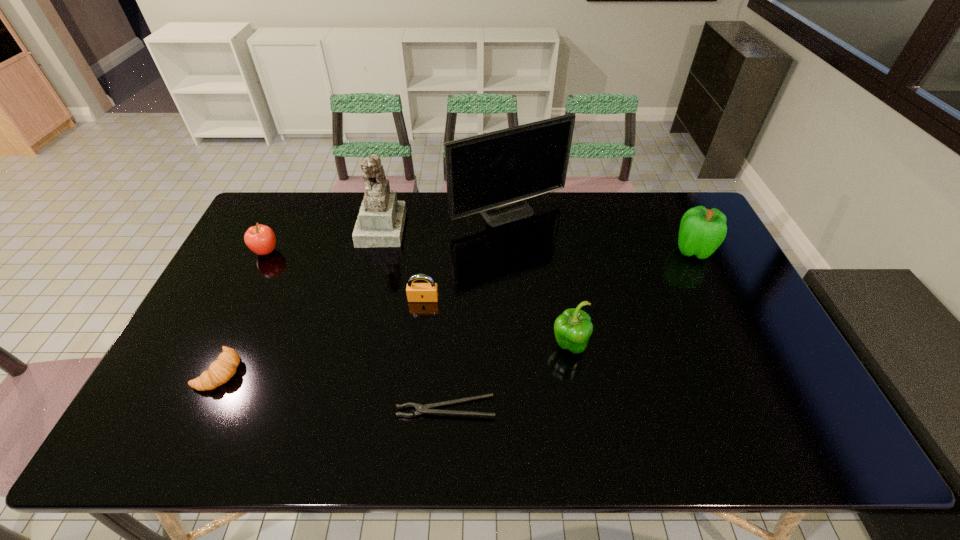
At what (x,y) coordinates should I click in order to perform the action: click on computer monitor. Please return your answer as a coordinate pair (x, y). The width and height of the screenshot is (960, 540). Looking at the image, I should click on (492, 173).

Find the location of a particular element. The width and height of the screenshot is (960, 540). figurine is located at coordinates (380, 223).

Identify the location of the right bell pepper. tap(702, 231).

This screenshot has width=960, height=540. Identify the location of the farther bell pepper. (702, 231).

The image size is (960, 540). Identify the location of the left bell pepper. (573, 328).

This screenshot has height=540, width=960. In order to click on apple in this screenshot , I will do `click(260, 239)`.

The width and height of the screenshot is (960, 540). What are the coordinates of `padlock` in the screenshot? It's located at (416, 292).

You are a GUI agent. You are given a task and a screenshot of the screen. Output one action in this format:
    pyautogui.click(x=<x>, y=<y>)
    Task: Click on the seventh tallest object
    Image resolution: width=960 pixels, height=540 pixels.
    Given the screenshot: What is the action you would take?
    pyautogui.click(x=220, y=371)

The width and height of the screenshot is (960, 540). Find the location of `the shortest object`. the shortest object is located at coordinates (421, 409).

Identify the location of the nearest object. The image size is (960, 540). (421, 409).